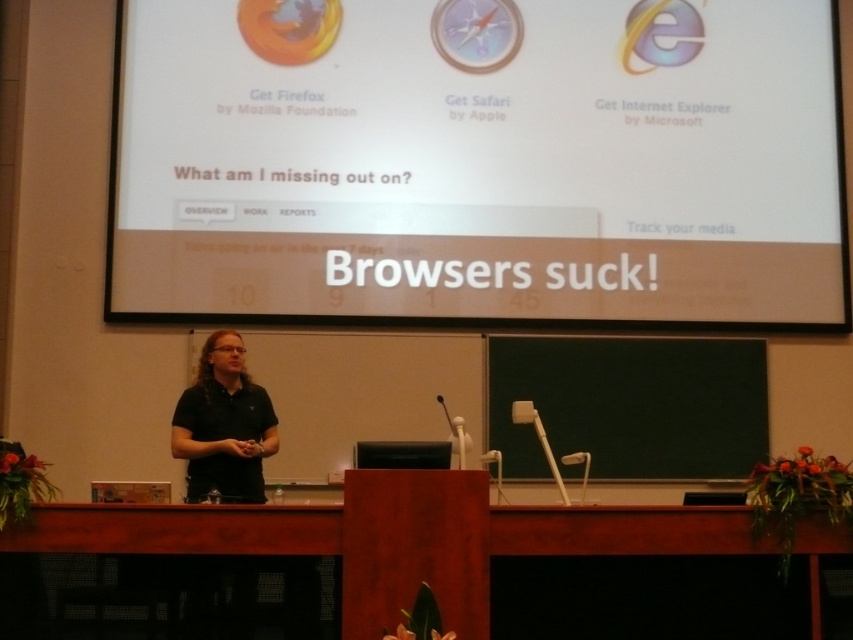
You are a photographer setting up for a presentation. You have two points marked on your camera screen at coordinates point (703, 182) and point (209, 401). If you want to focus on the closer point to the camera, which coordinate should you adjust your focus to?

Point (209, 401) is closer to the camera than point (703, 182), so you should adjust your focus to point (209, 401).

You are an attendee at the presentation. You notice the white text on projector screen at upper center and the black matte shirt at center. Which object is positioned to the right when viewed from your perspective?

The white text on projector screen at upper center is positioned to the right of the black matte shirt at center.

You are sitting in the audience and want to read the white text on projector screen at upper center while also looking at the black matte shirt at center. Which object will appear larger in your view?

The white text on projector screen at upper center will appear much larger in your view because it is much taller than the black matte shirt at center.